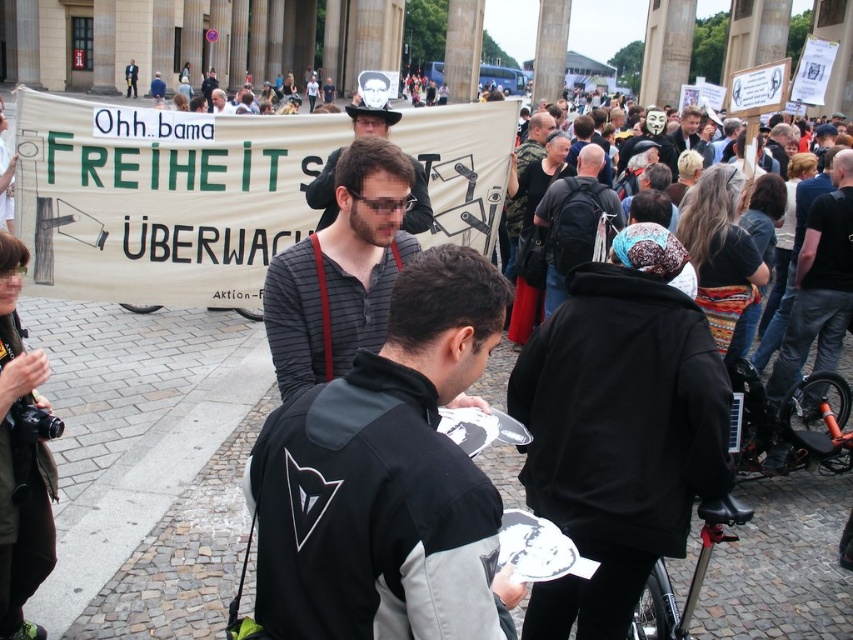
Identify the location of black leather jacket at upper right. (819, 284).

Between point (786, 381) and point (592, 236), which one is positioned in front?

Point (786, 381)

Which is behind, point (830, 346) or point (576, 216)?

The point (576, 216) is more distant.

The height and width of the screenshot is (640, 853). Find the location of `black leather jacket at upper right`. black leather jacket at upper right is located at coordinates (819, 284).

Between point (276, 336) and point (766, 461), which one is positioned in front?

Point (276, 336) is more forward.

What do you see at coordinates (341, 269) in the screenshot? I see `striped cotton shirt at center` at bounding box center [341, 269].

Where is `striped cotton shirt at center`? The image size is (853, 640). striped cotton shirt at center is located at coordinates (341, 269).

Is black striped shirt at center thinner than striped cotton shirt at center?

No, black striped shirt at center is not thinner than striped cotton shirt at center.

At what (x,y) coordinates should I click in order to perform the action: click on black striped shirt at center. Please return your answer as a coordinate pair (x, y). This screenshot has height=640, width=853. Looking at the image, I should click on (387, 477).

Measure the distance between point (474, 595) and camera.

They are 21.37 meters apart.

This screenshot has height=640, width=853. Identify the location of black striped shirt at center. (387, 477).